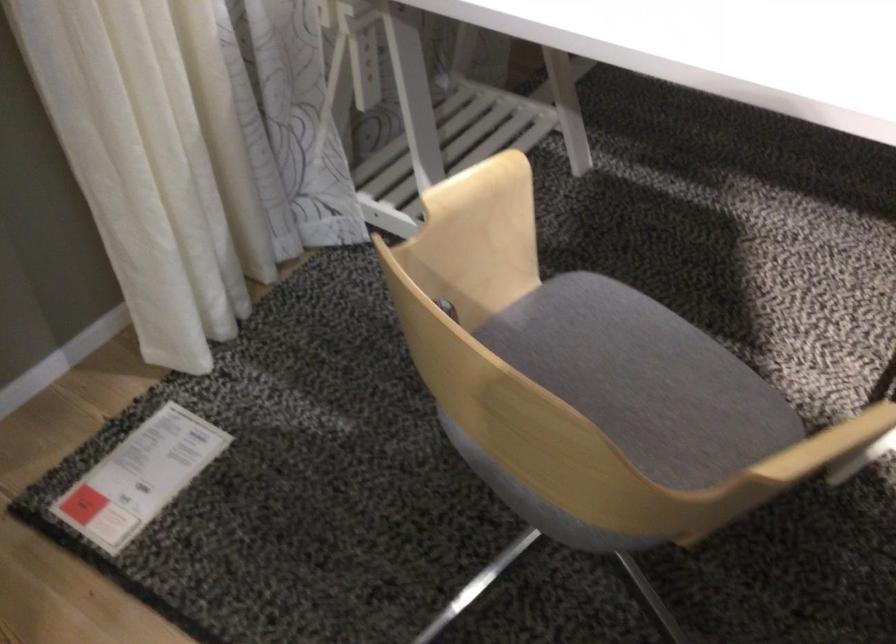
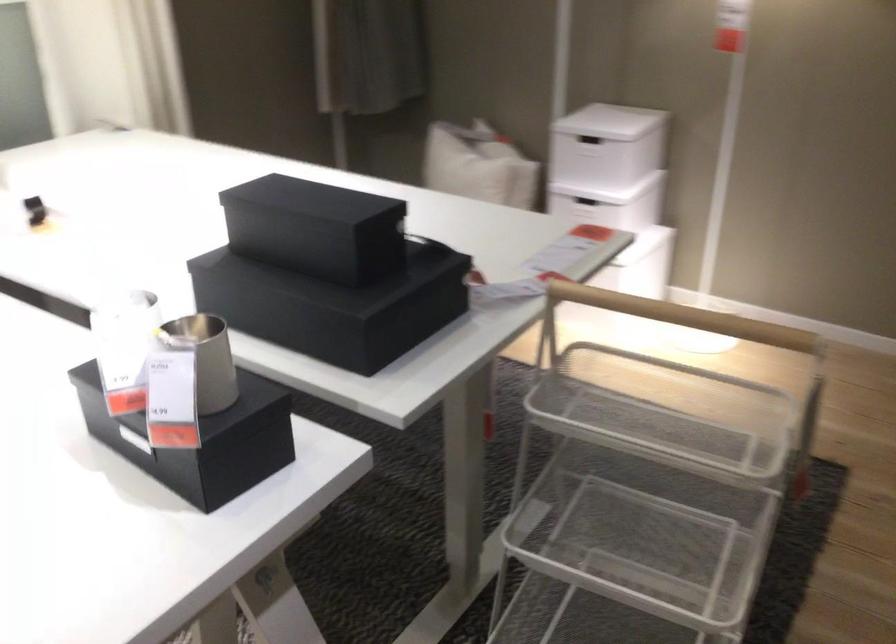
Question: The images are taken continuously from a first-person perspective. In which direction are you moving?

Choices:
 (A) Left
 (B) Right
 (C) Forward
 (D) Backward

Answer: (B)